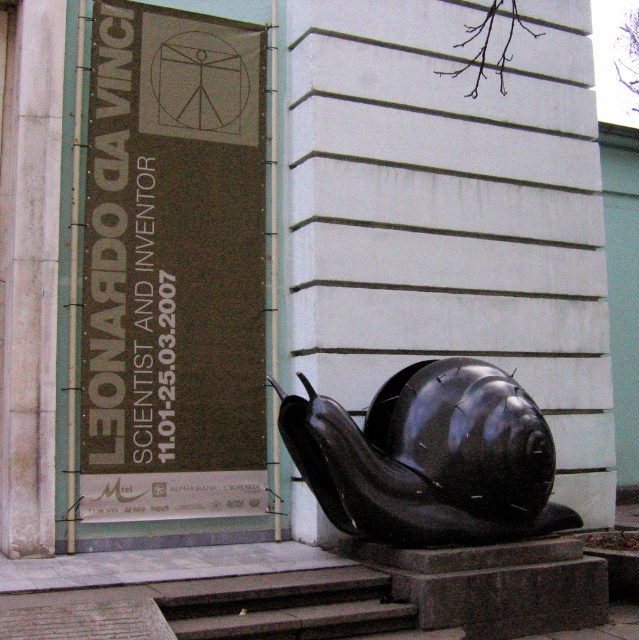
You are a delivery person holding a box that is 28 inches wide. You need to place it between the black matte snail at center and the gray stone stairs at lower center. Is there enough space?

The distance between the black matte snail at center and the gray stone stairs at lower center is 30.31 inches. Since the box is 28 inches wide, there is enough space to place it between them.